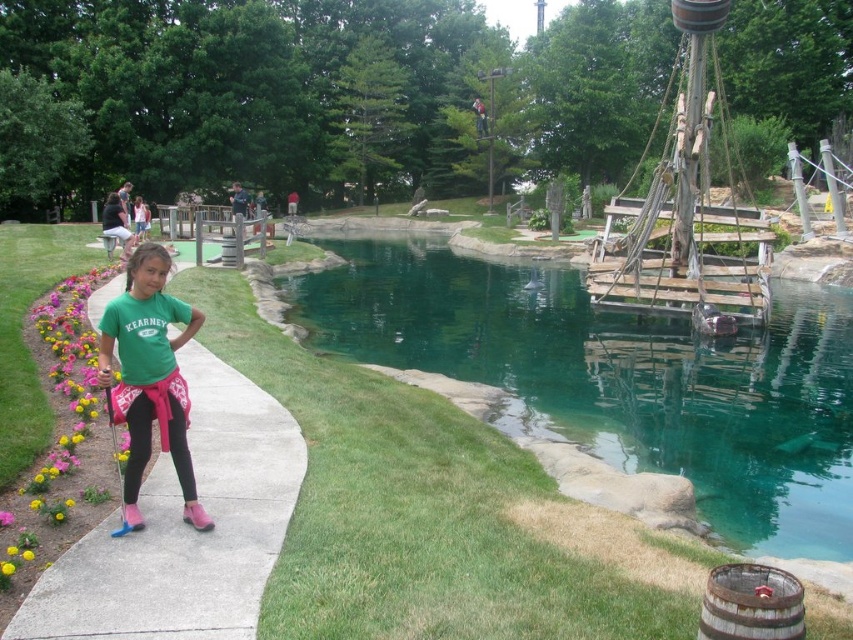
Question: Which object is positioned farthest from the concrete sidewalk at center left?

Choices:
 (A) teal glassy water at center
 (B) green matte shirt at center

Answer: (A)

Question: Does teal glassy water at center have a greater width compared to concrete sidewalk at center left?

Choices:
 (A) no
 (B) yes

Answer: (B)

Question: Where is teal glassy water at center located in relation to concrete sidewalk at center left in the image?

Choices:
 (A) right
 (B) left

Answer: (A)

Question: Which of the following is the closest to the observer?

Choices:
 (A) teal glassy water at center
 (B) concrete sidewalk at center left
 (C) green matte shirt at center

Answer: (B)

Question: Observing the image, what is the correct spatial positioning of teal glassy water at center in reference to concrete sidewalk at center left?

Choices:
 (A) right
 (B) left

Answer: (A)

Question: Which of the following is the farthest from the observer?

Choices:
 (A) teal glassy water at center
 (B) concrete sidewalk at center left

Answer: (A)